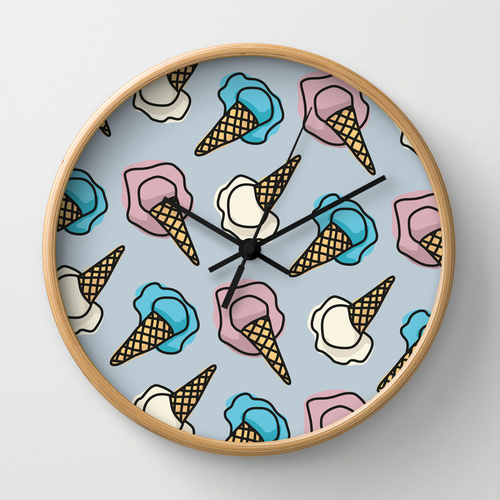
At what (x,y) coordinates should I click in order to perform the action: click on clock hands. Please return your answer as a coordinate pair (x, y). Looking at the image, I should click on (321, 209), (274, 186), (219, 231).